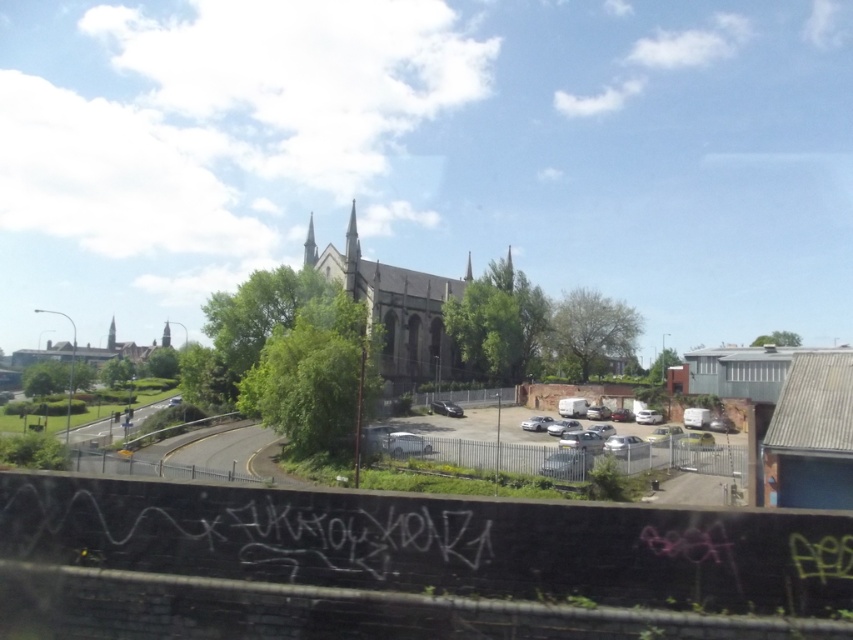
You are a city planner assessing the space between the dark gray stone church at center and the matte gray building at center. Given that the minimum required distance for a new pedestrian walkway is 70 meters, can the walkway be constructed between them?

The distance between the dark gray stone church at center and the matte gray building at center is 74.26 meters, which exceeds the required 70 meters. Therefore, the pedestrian walkway can be constructed between them.

You are an architect analyzing the scene. You need to determine which structure is more prominent in height between the dark gray stone church at center and the matte gray building at center. Based on the scene, which one is taller?

The dark gray stone church at center is taller than the matte gray building at center.

You are a drone operator who needs to fly a drone from the black wall with graffiti in various colors to the dark gray stone church at center. The drone has a maximum flight range of 80 meters. Will it be able to reach the church?

The distance between the black wall with graffiti in various colors and the dark gray stone church at center is 80.65 meters. Since the drone has a maximum flight range of 80 meters, it will not be able to reach the church.